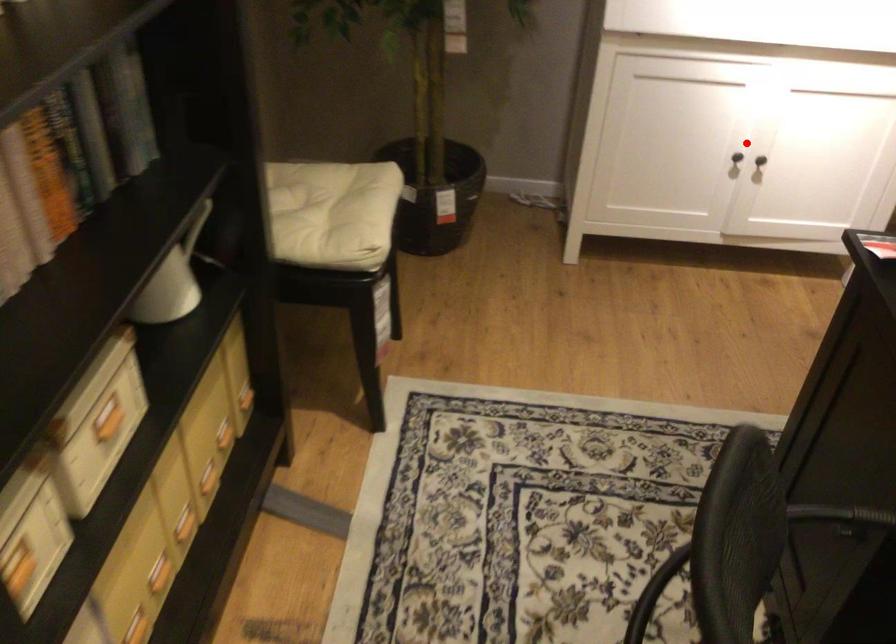
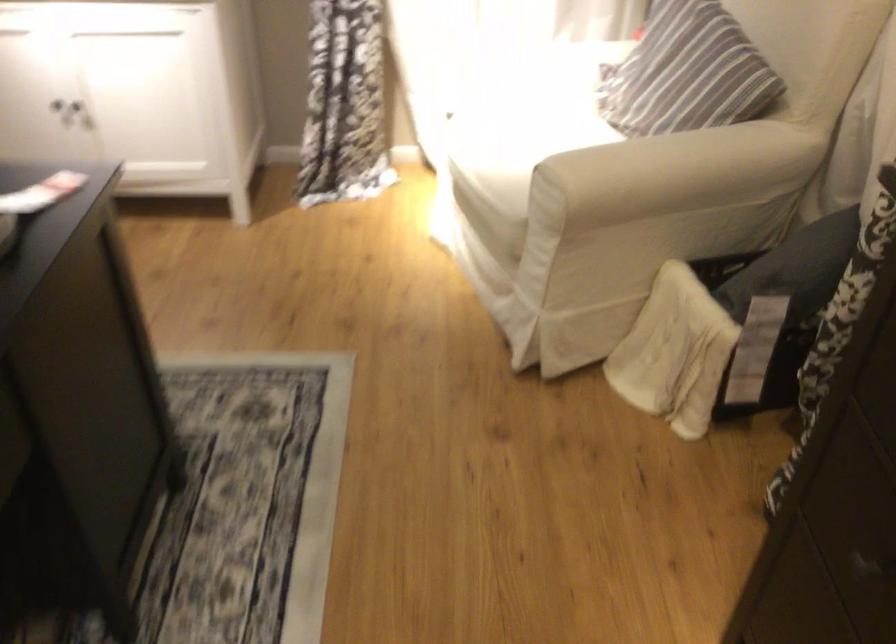
The point at the highlighted location is marked in the first image. Where is the corresponding point in the second image?

(52, 99)